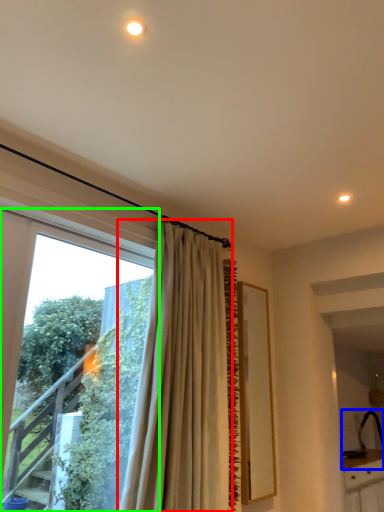
Question: Which is nearer to the curtain (highlighted by a red box)? sink (highlighted by a blue box) or window (highlighted by a green box).

Choices:
 (A) sink
 (B) window

Answer: (B)